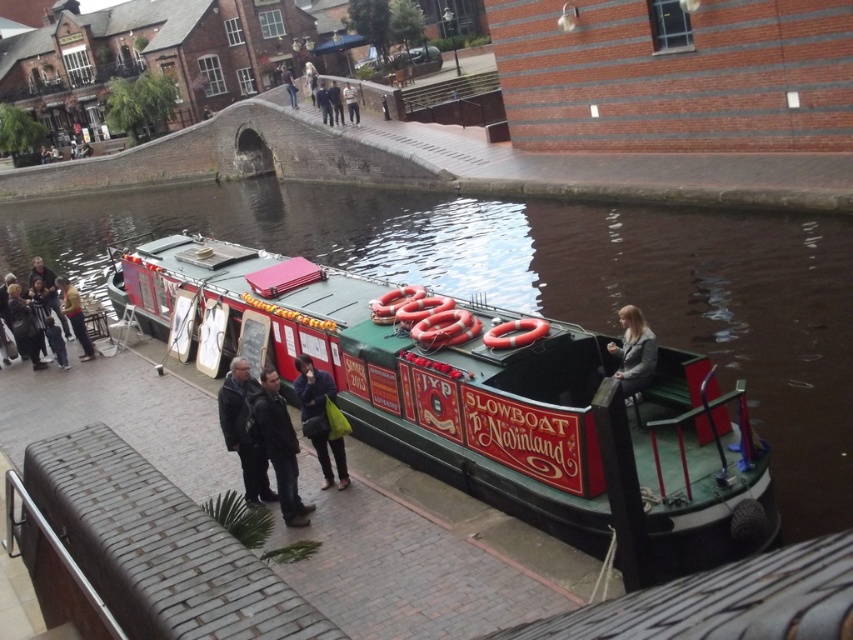
Consider the image. You are standing on the brick dock at lower left and want to greet the person wearing the light brown leather jacket at center. Which direction should you move to reach them?

The brick dock at lower left is to the right of the light brown leather jacket at center, so you should move to your left to reach them.

You are a photographer planning to take a group photo of the people in the canal scene. You need to ensure that the yellow jacket at left and the dark brown leather jacket at center are both visible in the frame. Considering their sizes, which jacket will appear bigger in the photo?

The yellow jacket at left will appear bigger in the photo because it has a larger size compared to the dark brown leather jacket at center.

You are a photographer standing on the towpath. You want to take a photo of the dark gray jacket at center and the yellow jacket at left. Which jacket appears narrower in the photo?

The dark gray jacket at center appears narrower in the photo because it is thinner than the yellow jacket at left.